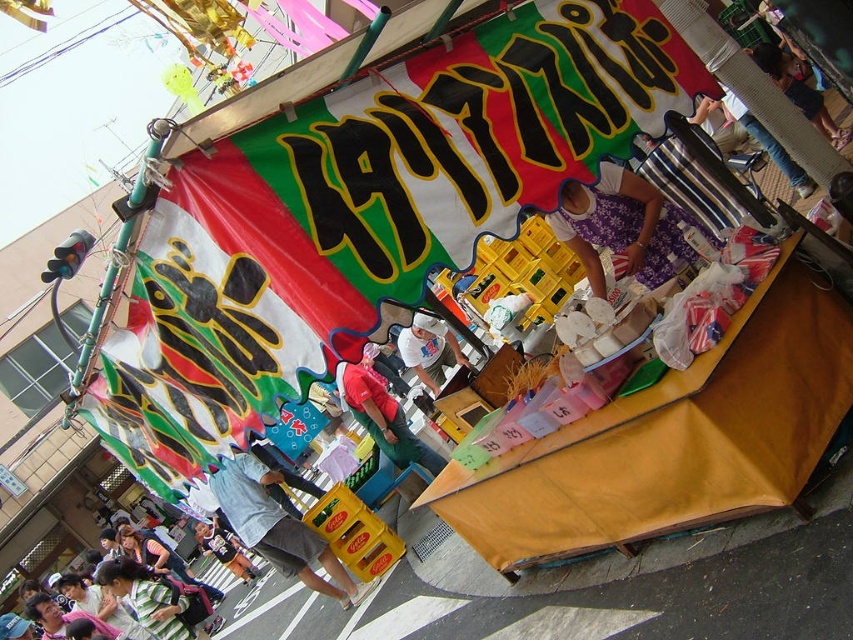
Question: Does denim shorts at lower left have a greater width compared to white cotton t-shirt at center?

Choices:
 (A) no
 (B) yes

Answer: (B)

Question: Can you confirm if denim shorts at lower left is positioned to the left of light blue denim jacket at lower left?

Choices:
 (A) no
 (B) yes

Answer: (A)

Question: Which point is closer to the camera taking this photo?

Choices:
 (A) (583, 188)
 (B) (438, 342)
 (C) (225, 554)
 (D) (287, 525)

Answer: (A)

Question: Which object is the closest to the light blue denim jacket at lower left?

Choices:
 (A) purple fabric dress at center
 (B) denim shorts at lower left
 (C) white cotton t-shirt at center

Answer: (C)

Question: Estimate the real-world distances between objects in this image. Which object is farther from the purple fabric dress at center?

Choices:
 (A) white cotton t-shirt at center
 (B) denim shorts at lower left

Answer: (B)

Question: Can you confirm if denim shorts at lower left is bigger than white cotton t-shirt at center?

Choices:
 (A) no
 (B) yes

Answer: (B)